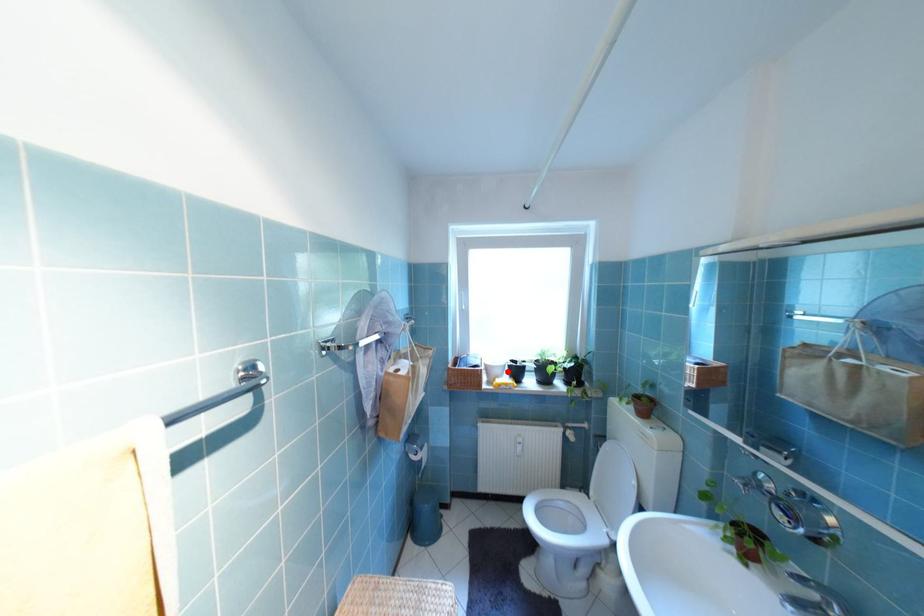
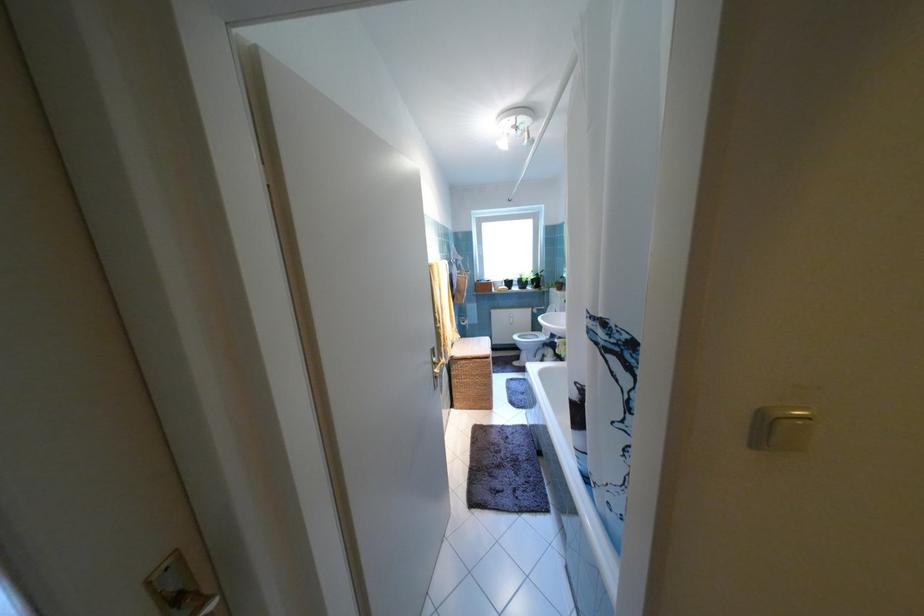
Where in the second image is the point corresponding to the highlighted location from the first image?

(508, 285)